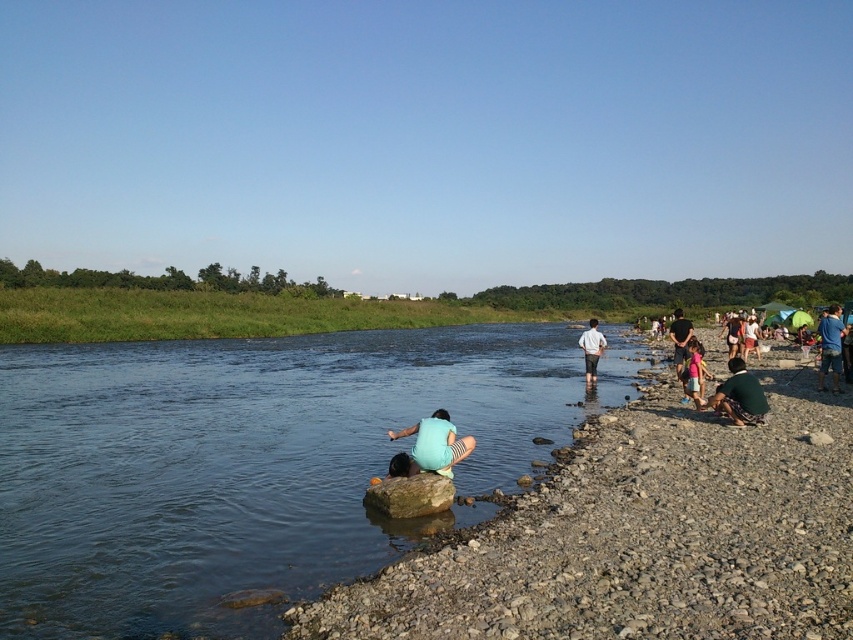
Question: Which point is closer to the camera?

Choices:
 (A) dark green shirt at right
 (B) clear blue water at center
 (C) blue shirt at right
 (D) light blue fabric at center

Answer: (B)

Question: Which of the following is the closest to the observer?

Choices:
 (A) (674, 536)
 (B) (824, 332)

Answer: (A)

Question: Is smooth stone shore at lower left below blue shirt at right?

Choices:
 (A) yes
 (B) no

Answer: (A)

Question: Does white cotton shirt at center appear on the right side of light blue fabric shirt at right?

Choices:
 (A) yes
 (B) no

Answer: (B)

Question: Which point is closer to the camera?

Choices:
 (A) (585, 346)
 (B) (711, 406)

Answer: (B)

Question: Considering the relative positions of smooth stone shore at lower left and blue shirt at right in the image provided, where is smooth stone shore at lower left located with respect to blue shirt at right?

Choices:
 (A) left
 (B) right

Answer: (A)